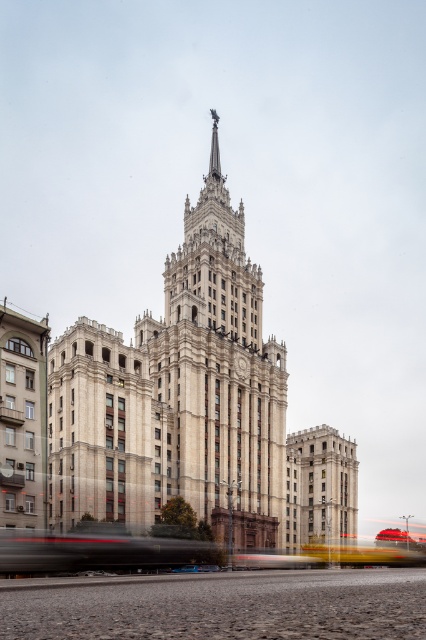
You are standing on the street in front of the building and notice two points marked on the building facade. The first point is at coordinates point (242, 323) and the second point is at point (287, 531). Which of these two points is closer to you?

Point (242, 323) is closer to you because it is further to the viewer than point (287, 531).

You are a photographer planning to capture the grand building in the image. You notice the white stone church at center and the smooth stone tower at center. Which structure should you focus on to ensure it fits entirely within your camera frame if your current lens has a limited field of view?

The white stone church at center might be wider than smooth stone tower at center, so focusing on the church would be better to ensure it fits within the limited field of view.

You are standing on the street in front of the building and want to take a photo of both the white stone church at center and the smooth stone tower at center. Which object should you focus on first to ensure both are in sharp focus?

You should focus on the white stone church at center first because it is closer to you than the smooth stone tower at center. By focusing on the closer object, the tower will also be in focus due to the depth of field.